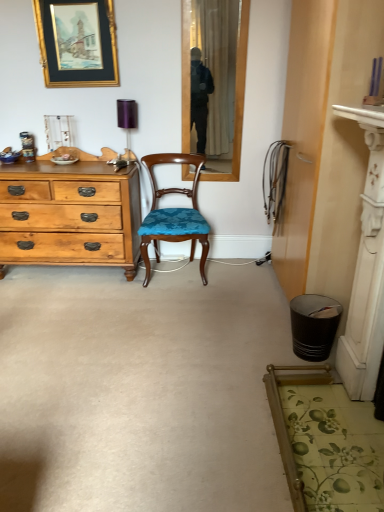
Question: Is black textured trash can at lower right aimed at gold-framed picture at upper left?

Choices:
 (A) no
 (B) yes

Answer: (A)

Question: Is black textured trash can at lower right next to gold-framed picture at upper left and touching it?

Choices:
 (A) no
 (B) yes

Answer: (A)

Question: From the image's perspective, does black textured trash can at lower right appear lower than gold-framed picture at upper left?

Choices:
 (A) yes
 (B) no

Answer: (A)

Question: Is black textured trash can at lower right positioned beyond the bounds of gold-framed picture at upper left?

Choices:
 (A) no
 (B) yes

Answer: (B)

Question: Is black textured trash can at lower right wider than gold-framed picture at upper left?

Choices:
 (A) no
 (B) yes

Answer: (B)

Question: Do you think purple fabric lampshade at upper center is within metallic can at left, or outside of it?

Choices:
 (A) inside
 (B) outside

Answer: (B)

Question: Does point (120, 117) appear closer or farther from the camera than point (29, 151)?

Choices:
 (A) closer
 (B) farther

Answer: (B)

Question: In the image, is purple fabric lampshade at upper center on the left side or the right side of metallic can at left?

Choices:
 (A) left
 (B) right

Answer: (B)

Question: Is purple fabric lampshade at upper center taller or shorter than metallic can at left?

Choices:
 (A) tall
 (B) short

Answer: (A)

Question: Considering their positions, is gold-framed picture at upper left located in front of or behind purple fabric lampshade at upper center?

Choices:
 (A) front
 (B) behind

Answer: (A)

Question: From a real-world perspective, is gold-framed picture at upper left physically located above or below purple fabric lampshade at upper center?

Choices:
 (A) below
 (B) above

Answer: (B)

Question: Looking at the image, does gold-framed picture at upper left seem bigger or smaller compared to purple fabric lampshade at upper center?

Choices:
 (A) big
 (B) small

Answer: (A)

Question: Is point (104, 62) closer or farther from the camera than point (127, 154)?

Choices:
 (A) closer
 (B) farther

Answer: (A)

Question: In the image, is purple fabric lampshade at upper center on the left side or the right side of gold-framed picture at upper left?

Choices:
 (A) left
 (B) right

Answer: (B)

Question: Is purple fabric lampshade at upper center wider or thinner than gold-framed picture at upper left?

Choices:
 (A) wide
 (B) thin

Answer: (A)